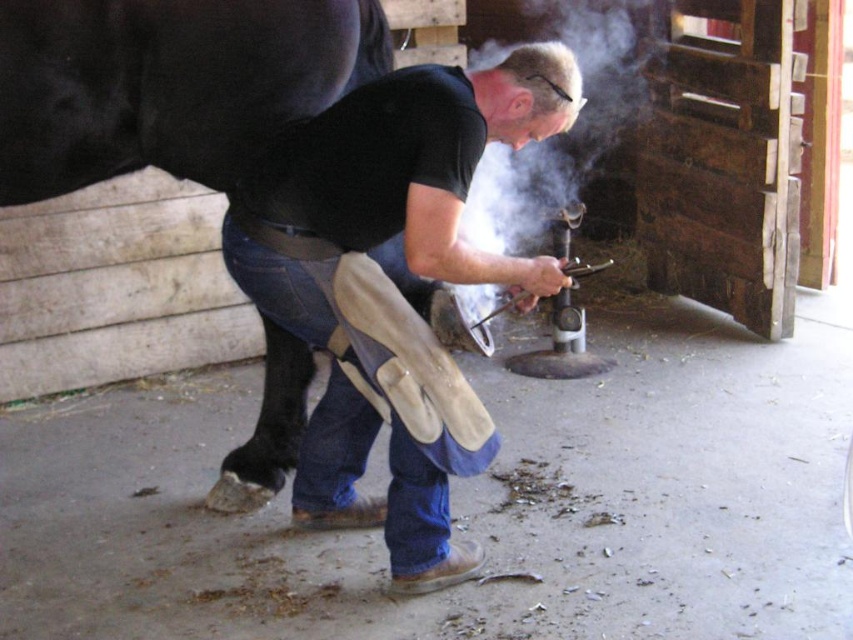
Question: Can you confirm if leather gloves at center is positioned below blue denim jeans at center?

Choices:
 (A) yes
 (B) no

Answer: (B)

Question: Can you confirm if leather gloves at center is positioned to the right of blue denim jeans at center?

Choices:
 (A) no
 (B) yes

Answer: (B)

Question: Can you confirm if leather gloves at center is positioned above blue denim jeans at center?

Choices:
 (A) yes
 (B) no

Answer: (A)

Question: Which object appears closest to the camera in this image?

Choices:
 (A) blue denim jeans at center
 (B) leather gloves at center

Answer: (B)

Question: Which object is closer to the camera taking this photo?

Choices:
 (A) leather gloves at center
 (B) blue denim jeans at center

Answer: (A)